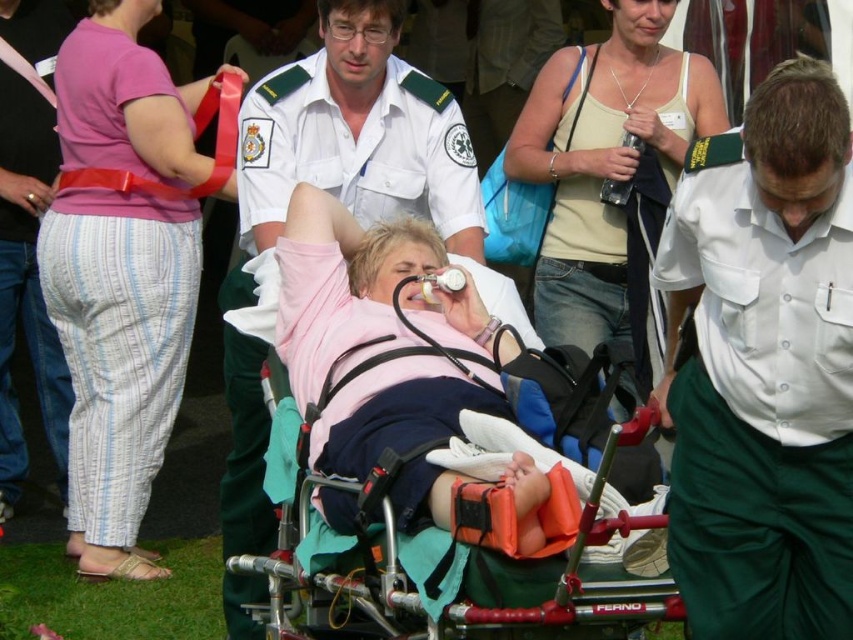
You are a medical student observing a patient on a stretcher. You notice the white uniform at center and the metallic stretcher at center. Which object is closer to you?

The white uniform at center is closer to you since it is further to the viewer than the metallic stretcher at center.

In the scene shown: You are a medical student observing a patient on a stretcher. You notice the pink cotton pants at left and the white uniform at center. Which item is higher in position relative to the other?

The pink cotton pants at left is taller than the white uniform at center, so the pink cotton pants at left is higher in position.

You are a medical student observing the scene. You notice the pink cotton pants at left and the white uniform at center. Which item has a smaller width measurement?

The pink cotton pants at left is thinner than the white uniform at center, so the pink cotton pants at left has a smaller width measurement.